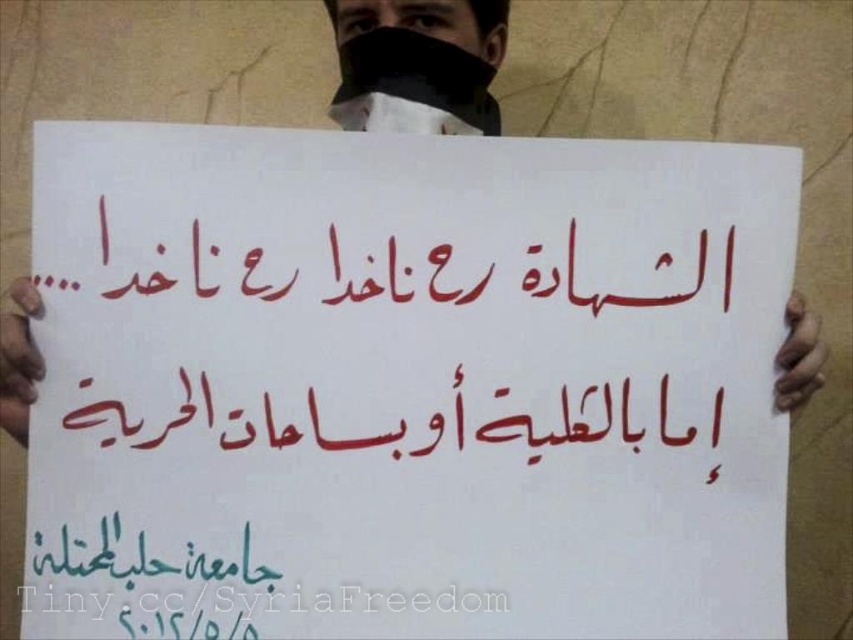
Question: Among these objects, which one is nearest to the camera?

Choices:
 (A) black fabric mask at upper center
 (B) red calligraphy at center
 (C) white paper at center
 (D) white paper sign at center

Answer: (D)

Question: Does white paper sign at center have a greater width compared to white paper at center?

Choices:
 (A) no
 (B) yes

Answer: (B)

Question: Which point is farther to the camera?

Choices:
 (A) (708, 246)
 (B) (381, 32)
 (C) (347, 68)
 (D) (485, 257)

Answer: (C)

Question: Is white paper sign at center below white paper at center?

Choices:
 (A) no
 (B) yes

Answer: (B)

Question: Which point appears closest to the camera in this image?

Choices:
 (A) (434, 19)
 (B) (212, 292)
 (C) (447, 10)
 (D) (368, 385)

Answer: (B)

Question: Can you confirm if white paper sign at center is wider than red calligraphy at center?

Choices:
 (A) no
 (B) yes

Answer: (B)